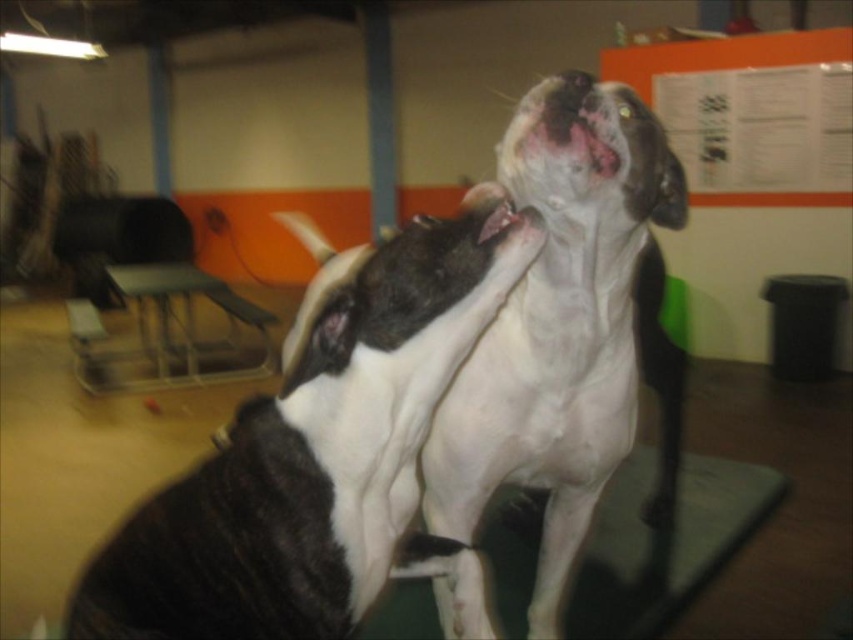
Question: Can you confirm if white smooth dog at center is positioned to the left of white glossy mouth at upper center?

Choices:
 (A) no
 (B) yes

Answer: (A)

Question: Which of the following is the farthest from the observer?

Choices:
 (A) white glossy mouth at upper center
 (B) white smooth dog at center
 (C) black and white fur dog at center

Answer: (B)

Question: Considering the relative positions of black and white fur dog at center and white smooth dog at center in the image provided, where is black and white fur dog at center located with respect to white smooth dog at center?

Choices:
 (A) left
 (B) right

Answer: (A)

Question: Does black and white fur dog at center lie in front of white smooth dog at center?

Choices:
 (A) yes
 (B) no

Answer: (A)

Question: Based on their relative distances, which object is nearer to the black and white fur dog at center?

Choices:
 (A) white glossy mouth at upper center
 (B) white smooth dog at center

Answer: (B)

Question: Which object is farther from the camera taking this photo?

Choices:
 (A) black and white fur dog at center
 (B) white smooth dog at center

Answer: (B)